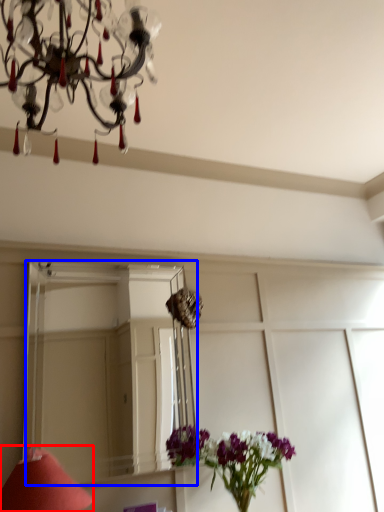
Question: Which object is further to the camera taking this photo, table lamp (highlighted by a red box) or mirror (highlighted by a blue box)?

Choices:
 (A) table lamp
 (B) mirror

Answer: (B)